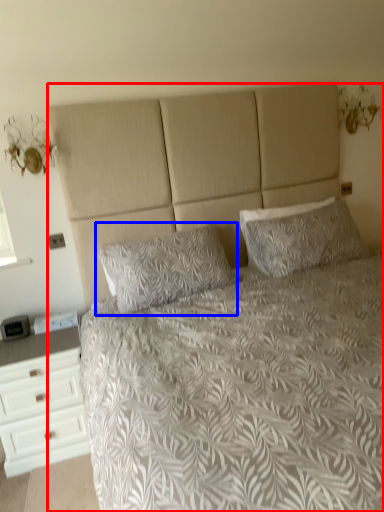
Question: Which object is closer to the camera taking this photo, bed (highlighted by a red box) or pillow (highlighted by a blue box)?

Choices:
 (A) bed
 (B) pillow

Answer: (A)